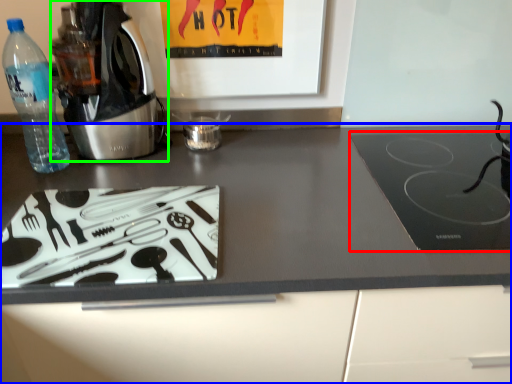
Question: Which object is the closest to the kitchen appliance (highlighted by a red box)? Choose among these: countertop (highlighted by a blue box) or home appliance (highlighted by a green box).

Choices:
 (A) countertop
 (B) home appliance

Answer: (A)